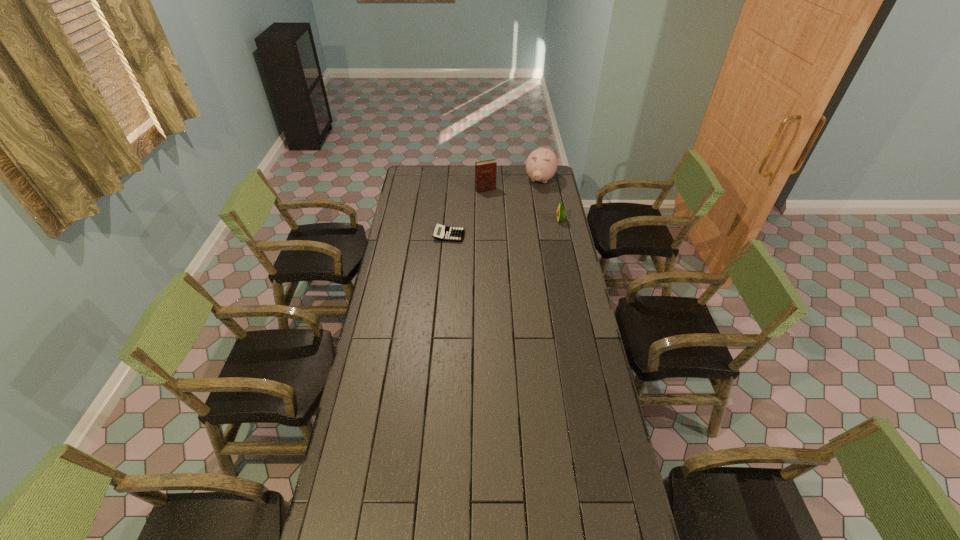
The width and height of the screenshot is (960, 540). Find the location of `calculator`. calculator is located at coordinates (443, 233).

You are a GUI agent. You are given a task and a screenshot of the screen. Output one action in this format:
    pyautogui.click(x=<x>, y=<y>)
    Task: Click on the shortest object
    
    Given the screenshot: What is the action you would take?
    click(443, 233)

Locate an element on the screen. avocado is located at coordinates (561, 213).

Locate an element on the screen. the third tallest object is located at coordinates (561, 213).

Where is `the third object from right to left`? The image size is (960, 540). the third object from right to left is located at coordinates (485, 171).

This screenshot has width=960, height=540. In order to click on piggy bank in this screenshot , I will do `click(541, 165)`.

Find the location of a particular element. Image resolution: width=960 pixels, height=540 pixels. vacant space situated 0.130m on the left of the calculator is located at coordinates (409, 235).

Identify the location of blank space located on the cut side of the avocado. point(522,220).

Locate an element on the screen. free location located on the cut side of the avocado is located at coordinates [x=516, y=220].

Locate an element on the screen. vacant space located 0.130m on the cut side of the avocado is located at coordinates (531, 220).